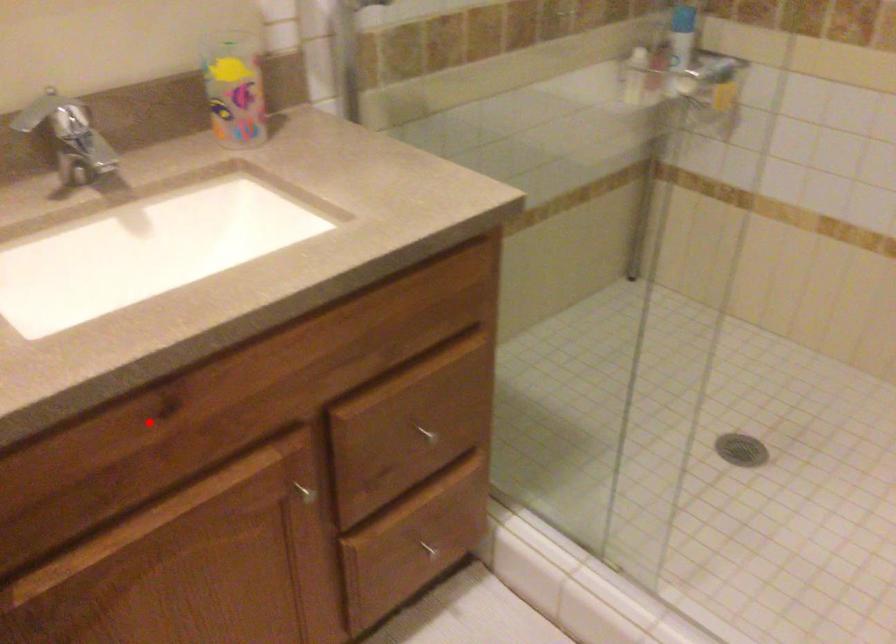
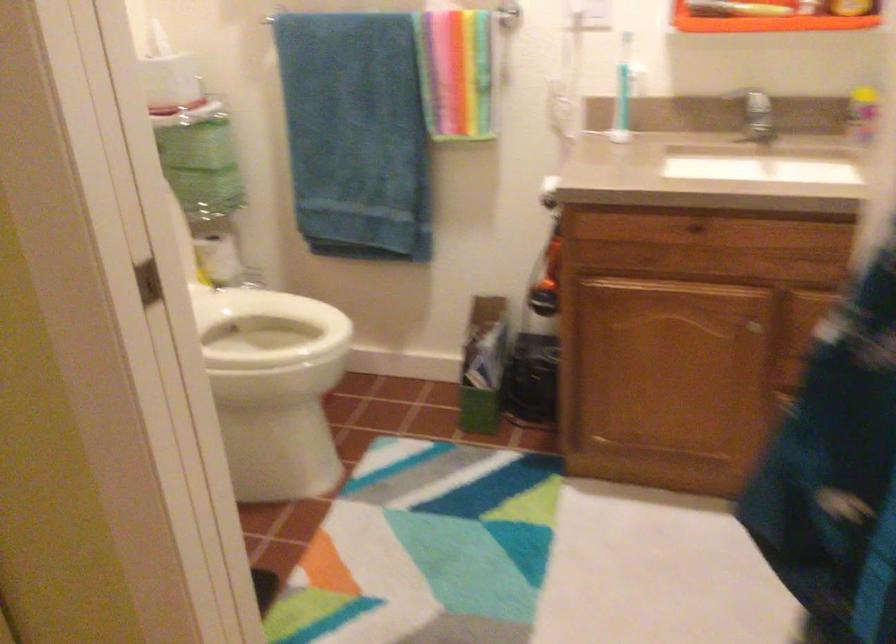
Question: I am providing you with two images of the same scene from different viewpoints. Image1 has a red point marked. In image2, the corresponding 3D location appears at what relative position? Reply with the corresponding letter.

Choices:
 (A) Closer
 (B) Farther

Answer: (B)